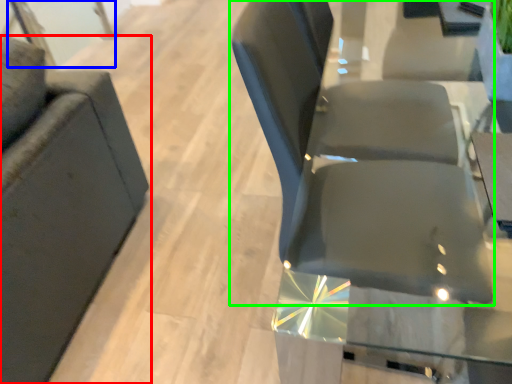
Question: Estimate the real-world distances between objects in this image. Which object is closer to chair (highlighted by a red box), glass door (highlighted by a blue box) or chair (highlighted by a green box)?

Choices:
 (A) glass door
 (B) chair

Answer: (B)